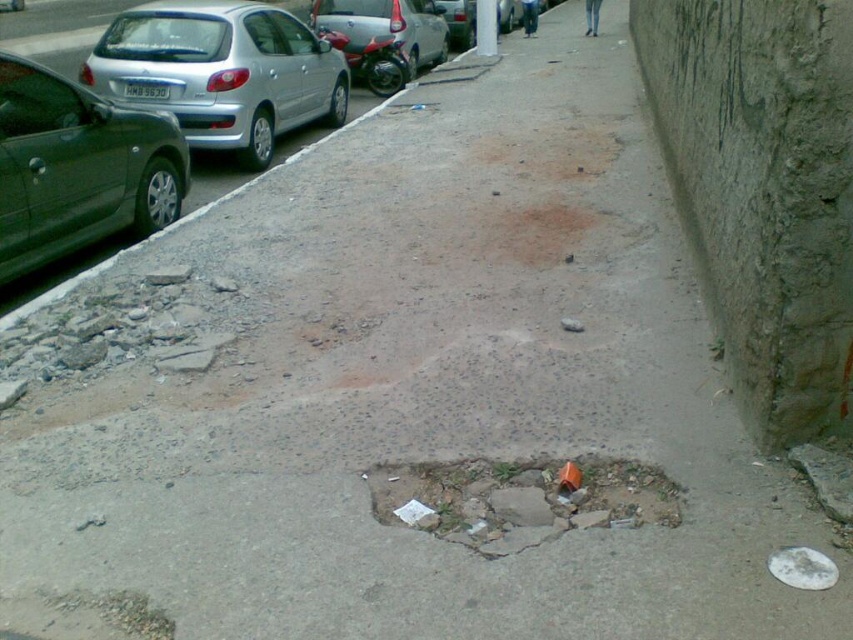
In the scene shown: You are a delivery person standing at the point labeled point (15, 196) and need to deliver a package to the location marked by point (370, 486). Considering the sidewalk condition described, which direction should you walk to reach your destination?

Since point (15, 196) is closer to you than point (370, 486), you should walk away from yourself towards point (370, 486) to reach the destination.

You are a delivery person trying to navigate a narrow sidewalk with a cart. You see the silver metallic hatchback at left and the silver metallic car at upper left. Which car is closer to you?

The silver metallic hatchback at left is closer to you because it is positioned under the silver metallic car at upper left, indicating it is in front.

You are a delivery person trying to navigate a narrow sidewalk with a cart. You see the metallic green car at left and the silver metallic car at upper left. Which car is taller, and how might that affect your path?

The silver metallic car at upper left is taller than the metallic green car at left. Since the silver metallic car at upper left is taller, it might block your path more, so you should plan your route around it to avoid obstacles.